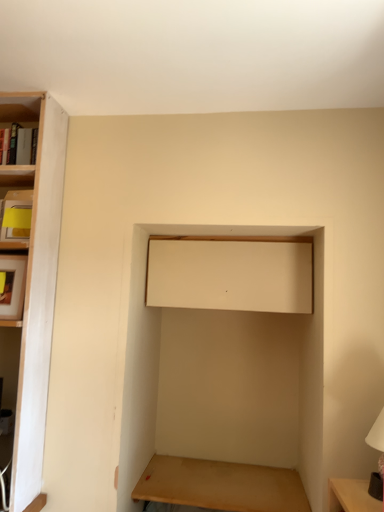
The width and height of the screenshot is (384, 512). In order to click on free space underneath beige matte cabinet at upper center (from a real-world perspective) in this screenshot , I will do `click(232, 475)`.